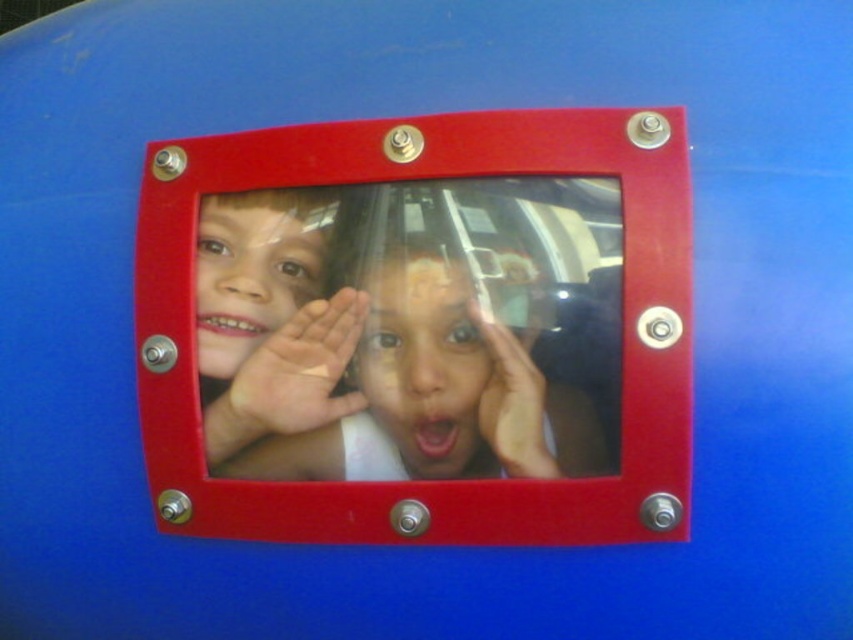
Question: Which point is closer to the camera taking this photo?

Choices:
 (A) (405, 467)
 (B) (415, 445)
 (C) (225, 307)

Answer: (B)

Question: Can you confirm if matte plastic window at center is positioned to the right of matte plastic face at center?

Choices:
 (A) no
 (B) yes

Answer: (B)

Question: Does smooth skin child at center appear over smooth skin face at center?

Choices:
 (A) no
 (B) yes

Answer: (A)

Question: Which point is farther from the camera taking this photo?

Choices:
 (A) (409, 324)
 (B) (245, 346)

Answer: (B)

Question: Which object is farther from the camera taking this photo?

Choices:
 (A) matte plastic face at center
 (B) smooth skin child at center
 (C) matte plastic window at center

Answer: (A)

Question: Does smooth skin child at center appear under matte plastic face at center?

Choices:
 (A) no
 (B) yes

Answer: (B)